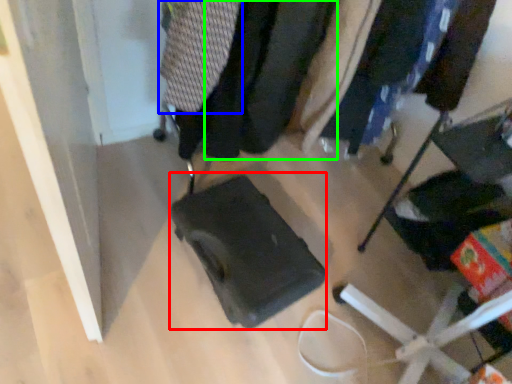
Question: Which is farther away from luggage (highlighted by a red box)? clothing (highlighted by a blue box) or clothing (highlighted by a green box)?

Choices:
 (A) clothing
 (B) clothing

Answer: (A)